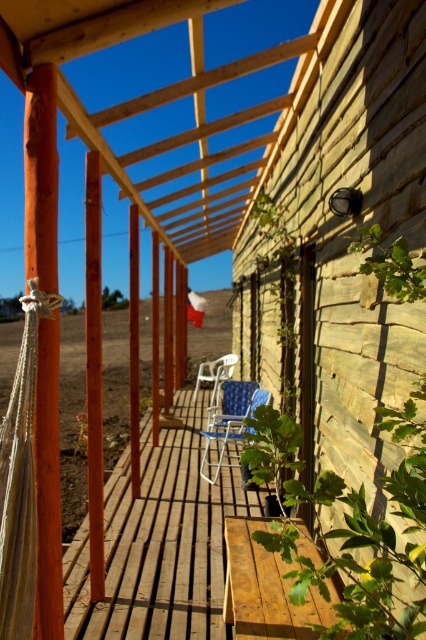
You are sitting on the deck and want to move to the blue woven chair at center without stepping on the white plastic chair at center. Is this possible?

The blue woven chair at center is located below the white plastic chair at center, so you can move to the blue woven chair at center without stepping on the white plastic chair at center since they are positioned vertically.